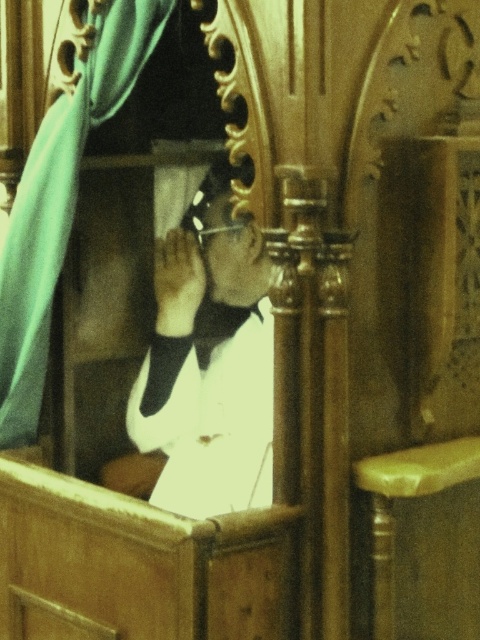
Question: Considering the real-world distances, which object is farthest from the black satin bow tie at center?

Choices:
 (A) teal fabric curtain at left
 (B) light brown wooden stool at lower right

Answer: (B)

Question: Based on their relative distances, which object is nearer to the teal fabric curtain at left?

Choices:
 (A) black satin bow tie at center
 (B) white glossy shirt at center
 (C) light brown wooden stool at lower right

Answer: (B)

Question: Which of the following is the closest to the observer?

Choices:
 (A) (386, 566)
 (B) (56, 136)
 (C) (216, 307)
 (D) (220, 276)

Answer: (A)

Question: Can you confirm if white glossy shirt at center is positioned above teal fabric curtain at left?

Choices:
 (A) yes
 (B) no

Answer: (B)

Question: Does light brown wooden stool at lower right appear on the right side of black satin bow tie at center?

Choices:
 (A) no
 (B) yes

Answer: (B)

Question: Is light brown wooden stool at lower right positioned behind black satin bow tie at center?

Choices:
 (A) no
 (B) yes

Answer: (A)